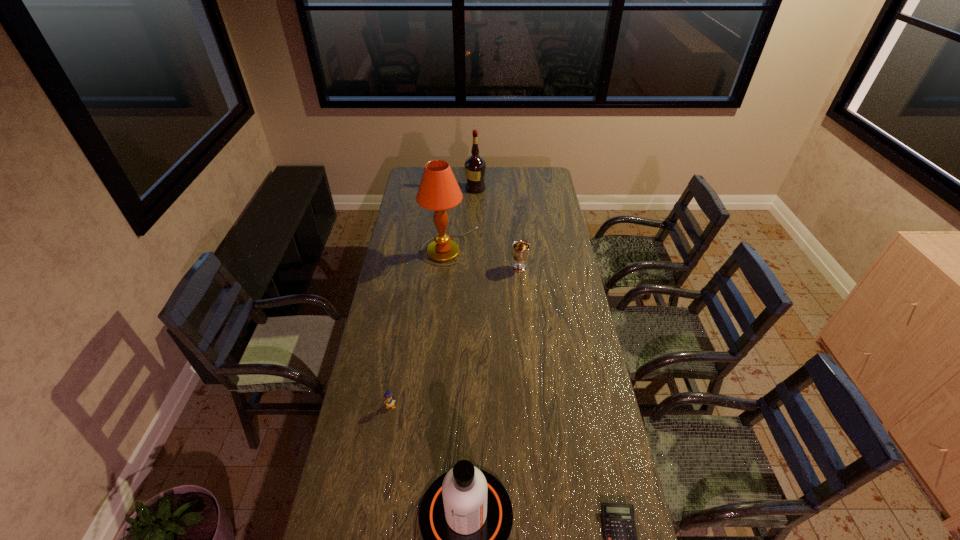
Identify the location of vacant area situated on the face of the duckling, where the monocle is placed. (374, 502).

At what (x,y) coordinates should I click in order to perform the action: click on object located in the far edge section of the desktop. Please return your answer as a coordinate pair (x, y). Looking at the image, I should click on (475, 166).

You are a GUI agent. You are given a task and a screenshot of the screen. Output one action in this format:
    pyautogui.click(x=<x>, y=<y>)
    Task: Click on the lamp that is at the left edge
    The width and height of the screenshot is (960, 540).
    Given the screenshot: What is the action you would take?
    pyautogui.click(x=438, y=190)

This screenshot has width=960, height=540. Identify the location of duckling that is at the left edge. (389, 401).

I want to click on vacant area at the left edge of the desktop, so click(408, 216).

Identify the location of free region at the right edge of the desktop. (618, 455).

At what (x,y) coordinates should I click in order to perform the action: click on vacant space at the far left corner of the desktop. Please return your answer as a coordinate pair (x, y). Looking at the image, I should click on (408, 177).

Where is `free spot between the third shortest object and the farthest object`? The height and width of the screenshot is (540, 960). free spot between the third shortest object and the farthest object is located at coordinates (497, 228).

You are a GUI agent. You are given a task and a screenshot of the screen. Output one action in this format:
    pyautogui.click(x=<x>, y=<y>)
    Task: Click on the free spot between the fifth shortest object and the third nearest object
    
    Given the screenshot: What is the action you would take?
    pyautogui.click(x=433, y=297)

Point out which object is positioned as the fourth nearest to the duckling. Please provide its 2D coordinates. Your answer should be formatted as a tuple, i.e. [(x, y)], where the tuple contains the x and y coordinates of a point satisfying the conditions above.

[(520, 252)]